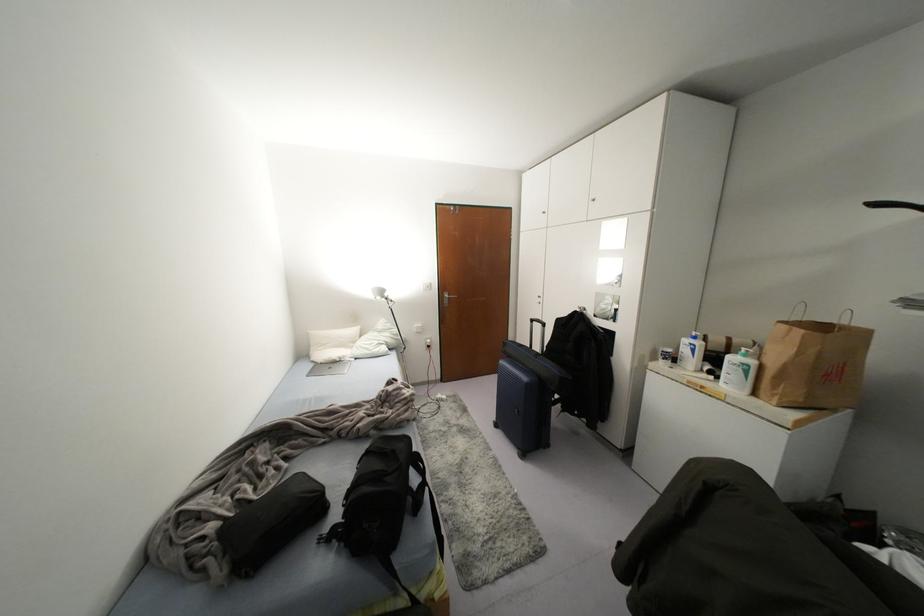
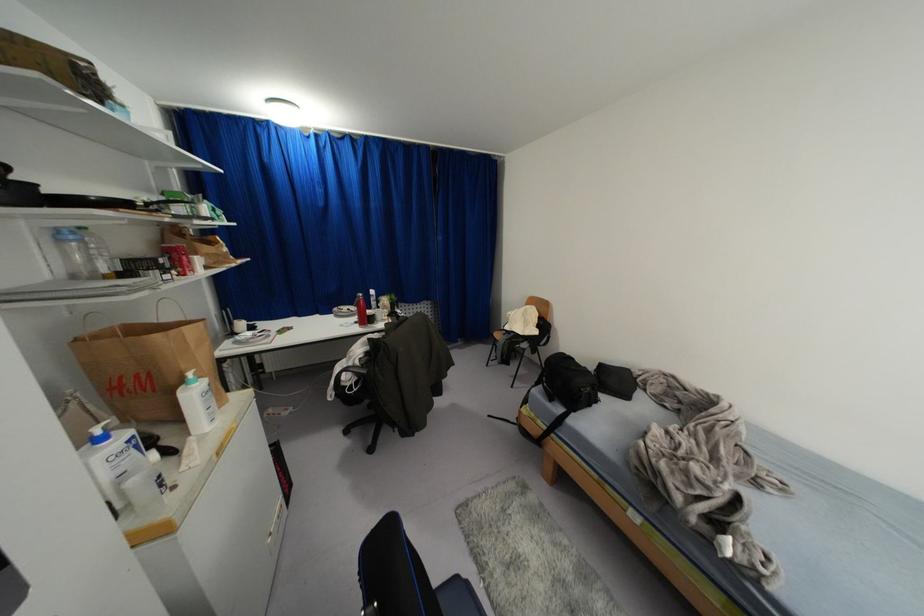
Locate, in the second image, the point that corresponds to pixel 744 349 in the first image.

(189, 374)